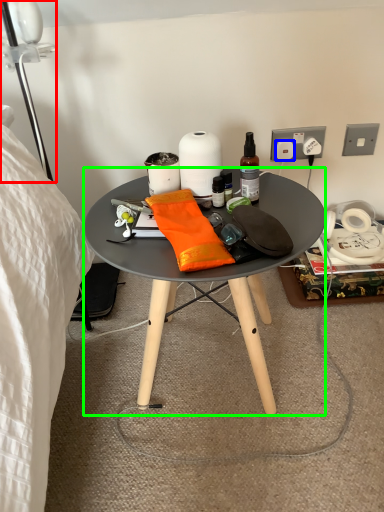
Question: Considering the real-world distances, which object is farthest from lamp (highlighted by a red box)? power outlet (highlighted by a blue box) or desk (highlighted by a green box)?

Choices:
 (A) power outlet
 (B) desk

Answer: (A)